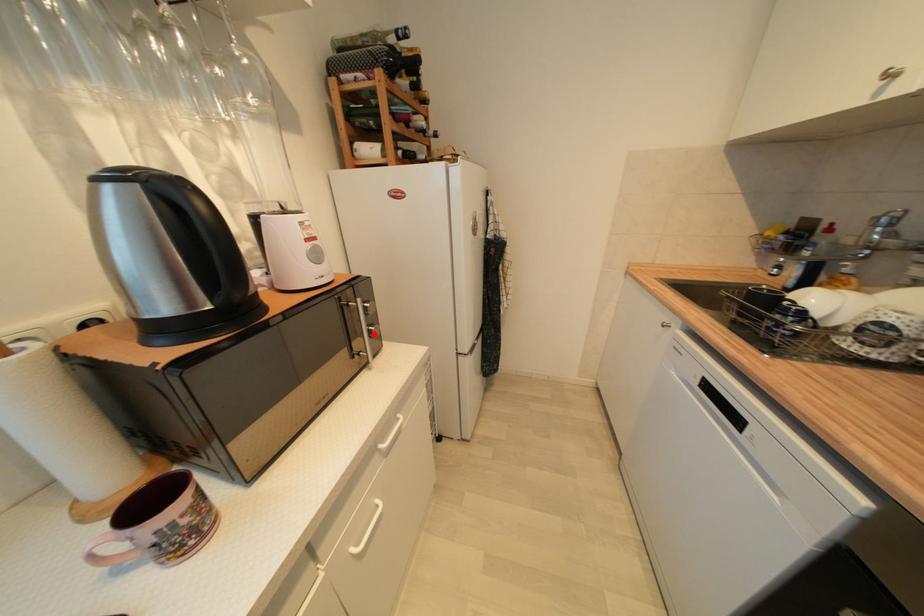
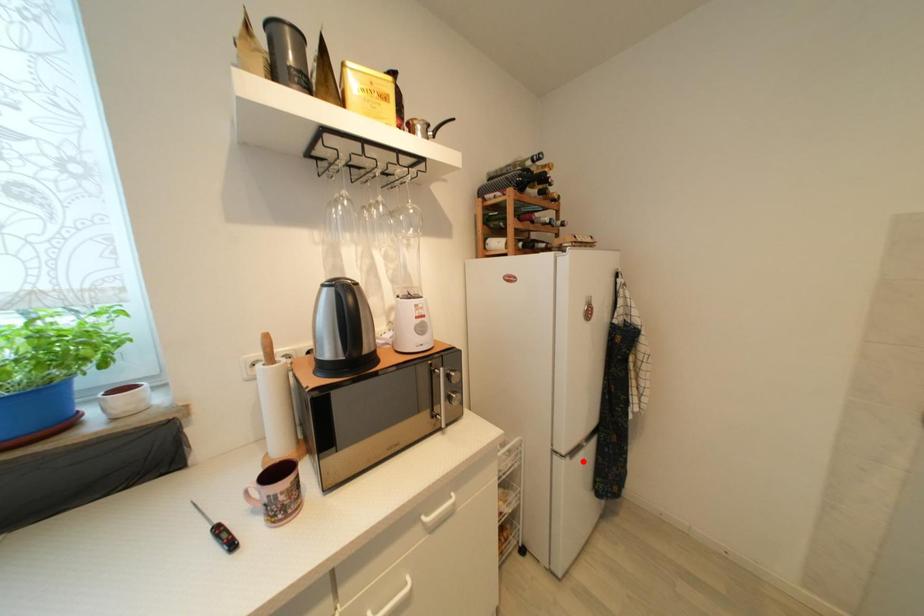
I am providing you with two images of the same scene from different viewpoints. A red point is marked on the first image and another point is marked on the second image. Is the red point in image1 aligned with the point shown in image2?

No